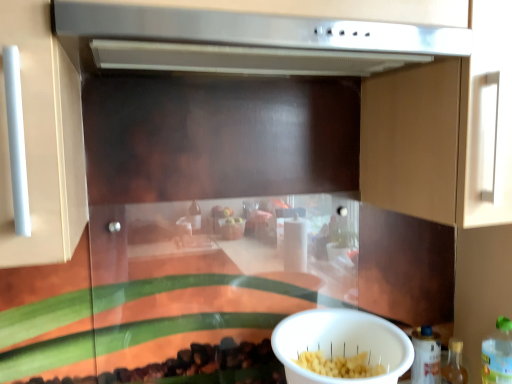
Question: From the image's perspective, is translucent plastic bottle at lower right, arranged as the second bottle when viewed from the left, positioned above or below translucent plastic bottle at lower right, the third bottle from the left?

Choices:
 (A) below
 (B) above

Answer: (A)

Question: From a real-world perspective, is translucent plastic bottle at lower right, arranged as the second bottle when viewed from the left, above or below translucent plastic bottle at lower right, the third bottle from the left?

Choices:
 (A) above
 (B) below

Answer: (B)

Question: Estimate the real-world distances between objects in this image. Which object is closer to the translucent plastic bottle at lower right, arranged as the second bottle when viewed from the left?

Choices:
 (A) stainless steel vent at upper center
 (B) white plastic bowl at lower center
 (C) translucent plastic bottle at lower right, which appears as the first bottle when viewed from the left
 (D) translucent plastic bottle at lower right, the third bottle from the left

Answer: (C)

Question: Which of these objects is positioned closest to the translucent plastic bottle at lower right, the third bottle from the left?

Choices:
 (A) white plastic bowl at lower center
 (B) translucent plastic bottle at lower right, arranged as the second bottle when viewed from the left
 (C) stainless steel vent at upper center
 (D) translucent plastic bottle at lower right, which appears as the first bottle when viewed from the left

Answer: (B)